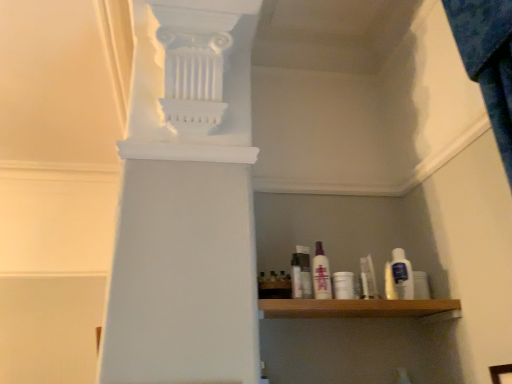
Question: Visually, is white plastic bottle at center, the fifth toiletry from the right, positioned to the left or to the right of translucent purple bottle at center, which is the fourth toiletry in right-to-left order?

Choices:
 (A) left
 (B) right

Answer: (A)

Question: Considering the positions of white plastic bottle at center, which ranks as the 1th toiletry in left-to-right order, and translucent purple bottle at center, placed as the 2th toiletry when sorted from left to right, in the image, is white plastic bottle at center, which ranks as the 1th toiletry in left-to-right order, wider or thinner than translucent purple bottle at center, placed as the 2th toiletry when sorted from left to right,?

Choices:
 (A) thin
 (B) wide

Answer: (A)

Question: Based on their relative distances, which object is nearer to the clear plastic bottle at center?

Choices:
 (A) white plastic bottle at center, the fifth toiletry from the right
 (B) clear plastic bag at center, the second toiletry when ordered from right to left
 (C) white plastic bottle at right, which is the 5th toiletry from left to right
 (D) translucent purple bottle at center, which is the fourth toiletry in right-to-left order
 (E) white plastic cup at center, which is the third toiletry from right to left

Answer: (A)

Question: Considering the real-world distances, which object is closest to the clear plastic bottle at center?

Choices:
 (A) white plastic bottle at center, the fifth toiletry from the right
 (B) clear plastic bag at center, positioned as the fourth toiletry in left-to-right order
 (C) white plastic cup at center, which is the 3th toiletry from left to right
 (D) white plastic bottle at right, which appears as the 1th toiletry when viewed from the right
 (E) translucent purple bottle at center, which is the fourth toiletry in right-to-left order

Answer: (A)